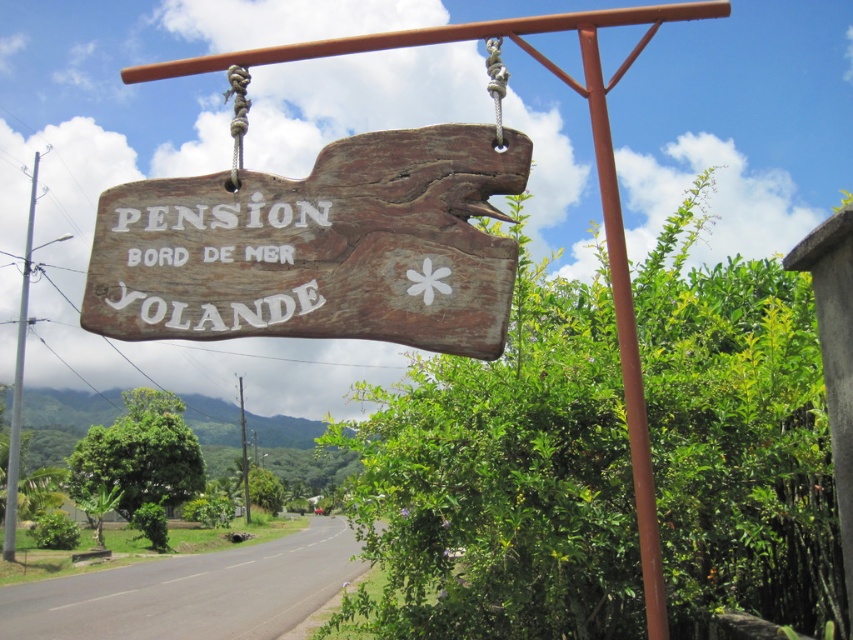
Who is higher up, weathered wood sign at center or rusty metal pole at upper center?

rusty metal pole at upper center is above.

Does weathered wood sign at center have a lesser width compared to rusty metal pole at upper center?

No.

Find the location of a particular element. weathered wood sign at center is located at coordinates (318, 248).

Consider the image. Which is more to the left, rusty metal pole at upper center or brown wooden pole at center?

brown wooden pole at center

Between rusty metal pole at upper center and brown wooden pole at center, which one appears on the right side from the viewer's perspective?

rusty metal pole at upper center is more to the right.

This screenshot has height=640, width=853. Identify the location of rusty metal pole at upper center. (625, 321).

Does rusty metal pole at upper center have a greater height compared to silver metallic pole at left?

Incorrect, rusty metal pole at upper center's height is not larger of silver metallic pole at left's.

Does rusty metal pole at upper center have a lesser height compared to silver metallic pole at left?

Yes, rusty metal pole at upper center is shorter than silver metallic pole at left.

Locate an element on the screen. The width and height of the screenshot is (853, 640). rusty metal pole at upper center is located at coordinates (625, 321).

Identify the location of rusty metal pole at upper center. Image resolution: width=853 pixels, height=640 pixels. (625, 321).